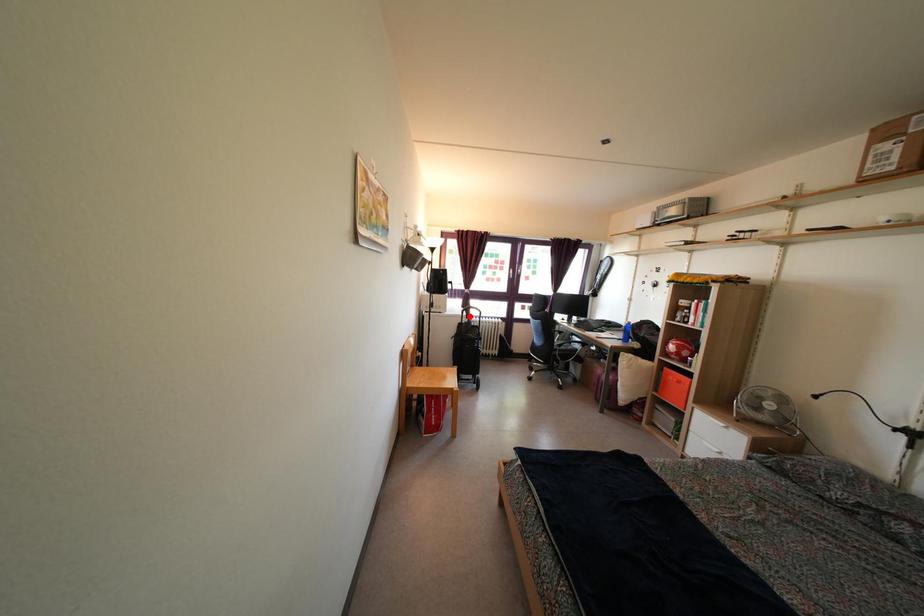
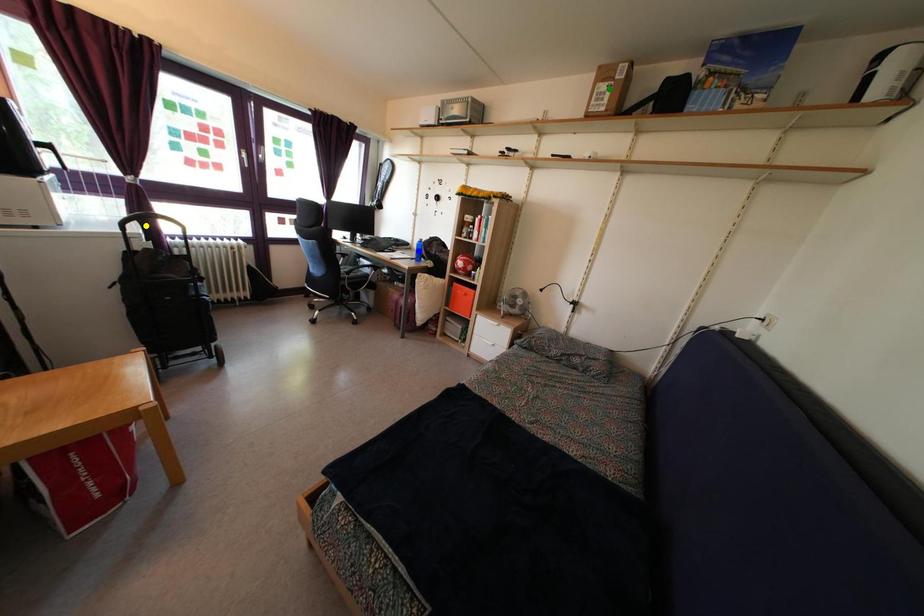
Question: I am providing you with two images of the same scene from different viewpoints. A red point is marked on the first image. You are given multiple points on the second image. In image 2, which mark is for the same physical point as the one in image 1?

Choices:
 (A) yellow point
 (B) green point
 (C) blue point

Answer: (A)